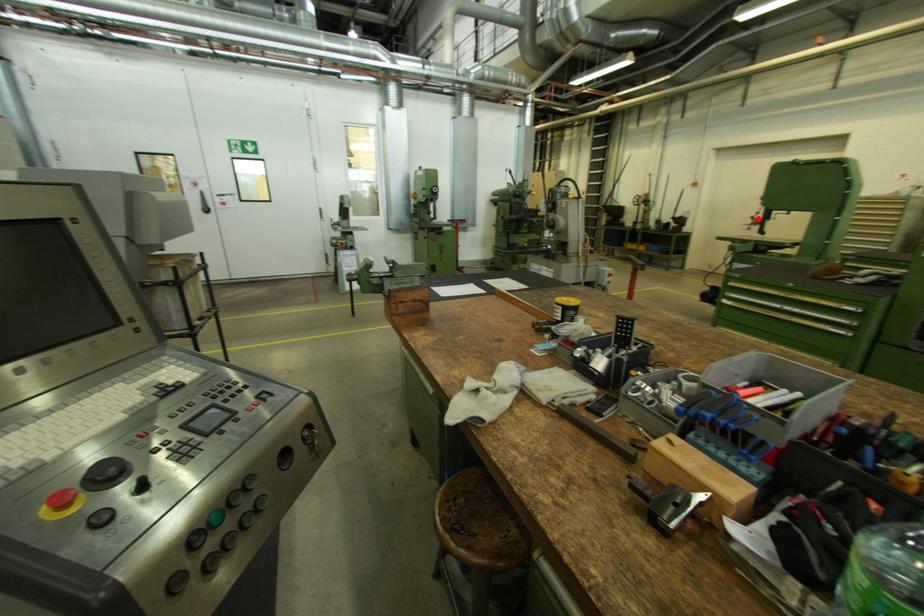
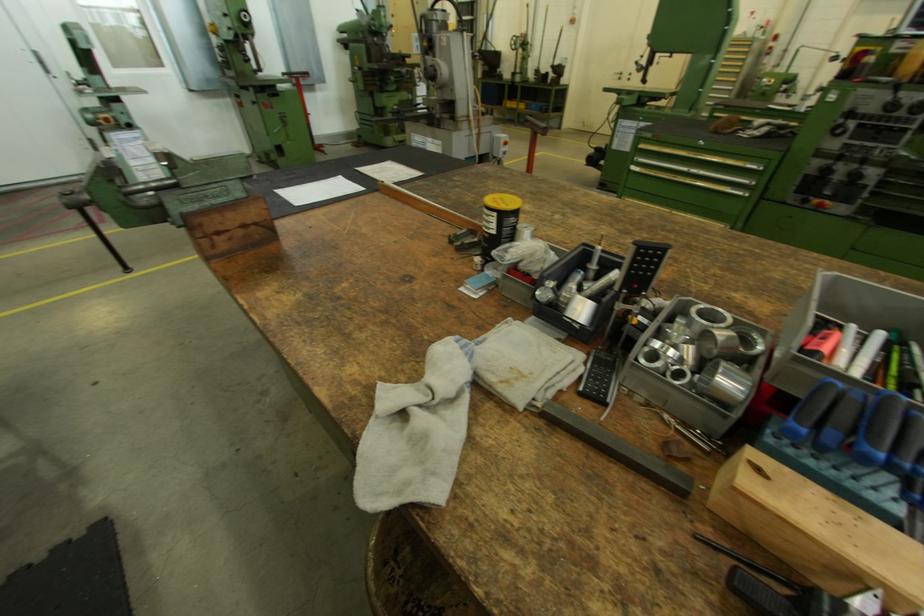
Locate, in the second image, the point that corresponds to the highlighted location in the first image.

(642, 63)